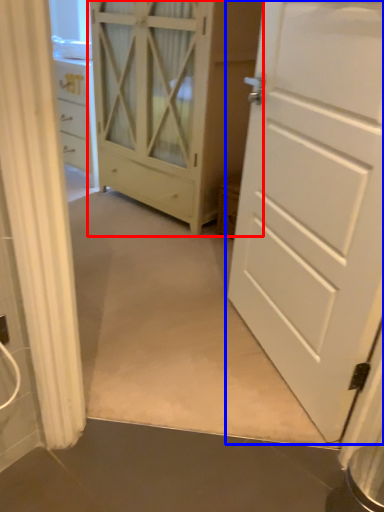
Question: Which point is further to the camera, cupboard (highlighted by a red box) or door (highlighted by a blue box)?

Choices:
 (A) cupboard
 (B) door

Answer: (A)